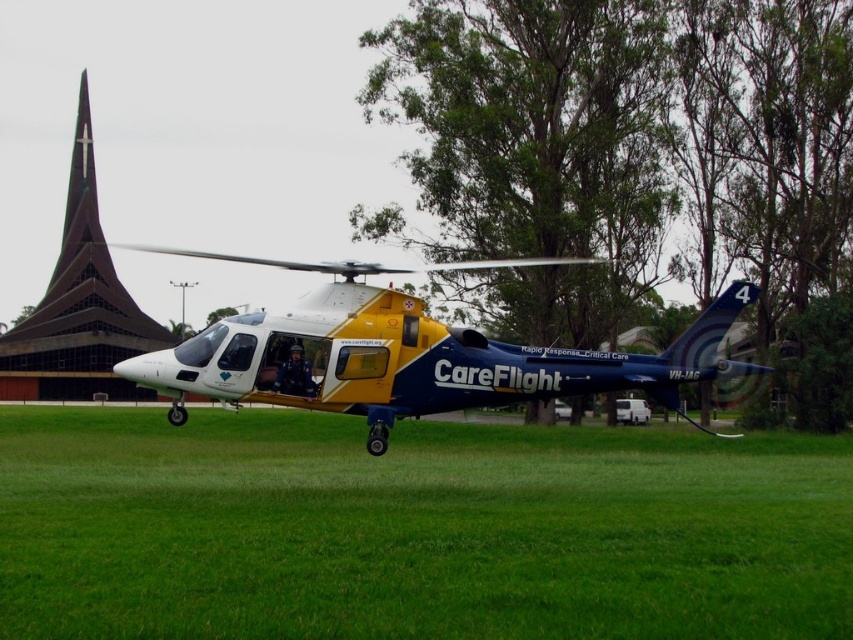
Question: Is yellow matte careflight helicopter at center above dark brown glass spire at upper left?

Choices:
 (A) no
 (B) yes

Answer: (A)

Question: Which of these objects is positioned farthest from the dark brown glass spire at upper left?

Choices:
 (A) green grass at lower center
 (B) yellow matte careflight helicopter at center

Answer: (A)

Question: Which of the following is the farthest from the observer?

Choices:
 (A) (85, 144)
 (B) (216, 384)
 (C) (428, 547)

Answer: (A)

Question: Is green grass at lower center below dark brown glass spire at upper left?

Choices:
 (A) no
 (B) yes

Answer: (B)

Question: Can you confirm if green grass at lower center is wider than yellow matte careflight helicopter at center?

Choices:
 (A) no
 (B) yes

Answer: (A)

Question: Which point is closer to the camera taking this photo?

Choices:
 (A) (531, 369)
 (B) (335, 573)

Answer: (B)